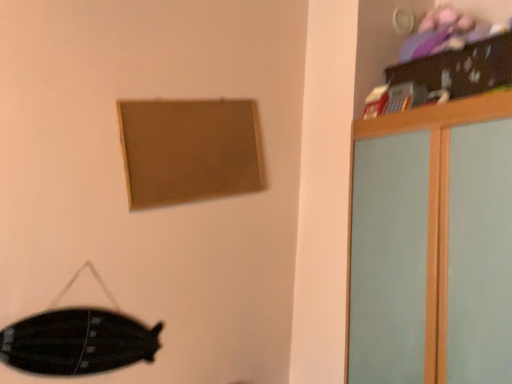
You are a GUI agent. You are given a task and a screenshot of the screen. Output one action in this format:
    pyautogui.click(x=<x>, y=<y>)
    Task: Click on the light wood dresser at upper right
    This screenshot has height=384, width=512.
    Given the screenshot: What is the action you would take?
    pyautogui.click(x=413, y=233)

From the image's perspective, who appears lower, matte brown picture frame at upper center or light wood dresser at upper right?

light wood dresser at upper right is shown below in the image.

Can you confirm if matte brown picture frame at upper center is thinner than light wood dresser at upper right?

Correct, the width of matte brown picture frame at upper center is less than that of light wood dresser at upper right.

How many degrees apart are the facing directions of matte brown picture frame at upper center and light wood dresser at upper right?

91 degrees.

Is matte brown picture frame at upper center oriented towards black matte swivel chair at lower left?

No.

Based on the photo, considering their positions, is matte brown picture frame at upper center located in front of or behind black matte swivel chair at lower left?

matte brown picture frame at upper center is positioned farther from the viewer than black matte swivel chair at lower left.

Consider the image. Between matte brown picture frame at upper center and black matte swivel chair at lower left, which one has larger size?

With larger size is matte brown picture frame at upper center.

Is matte brown picture frame at upper center inside the boundaries of black matte swivel chair at lower left, or outside?

matte brown picture frame at upper center is spatially situated outside black matte swivel chair at lower left.

Considering the relative sizes of black matte swivel chair at lower left and light wood dresser at upper right in the image provided, is black matte swivel chair at lower left shorter than light wood dresser at upper right?

Correct, black matte swivel chair at lower left is not as tall as light wood dresser at upper right.

Can you confirm if black matte swivel chair at lower left is bigger than light wood dresser at upper right?

No, black matte swivel chair at lower left is not bigger than light wood dresser at upper right.

Can we say black matte swivel chair at lower left lies outside light wood dresser at upper right?

Yes, black matte swivel chair at lower left is outside of light wood dresser at upper right.

From the image's perspective, is black matte swivel chair at lower left on top of light wood dresser at upper right?

No, from the image's perspective, black matte swivel chair at lower left is not above light wood dresser at upper right.

Would you say light wood dresser at upper right is a long distance from black matte swivel chair at lower left?

Yes, light wood dresser at upper right is far from black matte swivel chair at lower left.

From a real-world perspective, is light wood dresser at upper right on top of black matte swivel chair at lower left?

Yes.

Which of these two, light wood dresser at upper right or black matte swivel chair at lower left, is thinner?

Thinner between the two is black matte swivel chair at lower left.

Is light wood dresser at upper right at the right side of black matte swivel chair at lower left?

Indeed, light wood dresser at upper right is positioned on the right side of black matte swivel chair at lower left.

Based on the photo, considering the relative sizes of black matte swivel chair at lower left and matte brown picture frame at upper center in the image provided, is black matte swivel chair at lower left smaller than matte brown picture frame at upper center?

Correct, black matte swivel chair at lower left occupies less space than matte brown picture frame at upper center.

Are black matte swivel chair at lower left and matte brown picture frame at upper center making contact?

No, black matte swivel chair at lower left is not beside matte brown picture frame at upper center.

From the picture: Which is nearer, (110, 299) or (152, 206)?

The point (110, 299) is closer to the camera.

Which is behind, black matte swivel chair at lower left or matte brown picture frame at upper center?

matte brown picture frame at upper center is further from the camera.

Measure the distance between light wood dresser at upper right and matte brown picture frame at upper center.

light wood dresser at upper right is 27.95 inches away from matte brown picture frame at upper center.

Locate an element on the screen. picture frame behind the light wood dresser at upper right is located at coordinates pos(189,150).

Is light wood dresser at upper right beside matte brown picture frame at upper center?

There is a gap between light wood dresser at upper right and matte brown picture frame at upper center.

Looking at this image, from a real-world perspective, who is located lower, light wood dresser at upper right or matte brown picture frame at upper center?

light wood dresser at upper right.

Locate an element on the screen. This screenshot has width=512, height=384. dresser below the matte brown picture frame at upper center (from the image's perspective) is located at coordinates (413, 233).

Where is `picture frame to the right of black matte swivel chair at lower left`? This screenshot has height=384, width=512. picture frame to the right of black matte swivel chair at lower left is located at coordinates (189, 150).

Considering their positions, is black matte swivel chair at lower left positioned closer to matte brown picture frame at upper center than light wood dresser at upper right?

black matte swivel chair at lower left.

Looking at the image, which one is located closer to light wood dresser at upper right, black matte swivel chair at lower left or matte brown picture frame at upper center?

matte brown picture frame at upper center.

When comparing their distances from light wood dresser at upper right, does matte brown picture frame at upper center or black matte swivel chair at lower left seem further?

Based on the image, black matte swivel chair at lower left appears to be further to light wood dresser at upper right.

Based on their spatial positions, is matte brown picture frame at upper center or light wood dresser at upper right closer to black matte swivel chair at lower left?

matte brown picture frame at upper center lies closer to black matte swivel chair at lower left than the other object.

When comparing their distances from black matte swivel chair at lower left, does light wood dresser at upper right or matte brown picture frame at upper center seem further?

light wood dresser at upper right lies further to black matte swivel chair at lower left than the other object.

Looking at the image, which one is located closer to matte brown picture frame at upper center, light wood dresser at upper right or black matte swivel chair at lower left?

Based on the image, black matte swivel chair at lower left appears to be nearer to matte brown picture frame at upper center.

Identify the location of picture frame between black matte swivel chair at lower left and light wood dresser at upper right from left to right. (189, 150).